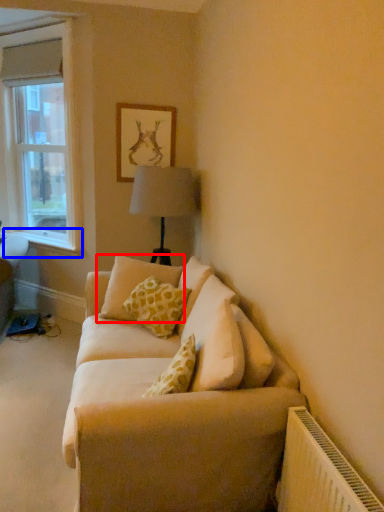
Question: Among these objects, which one is nearest to the camera, pillow (highlighted by a red box) or window sill (highlighted by a blue box)?

Choices:
 (A) pillow
 (B) window sill

Answer: (A)